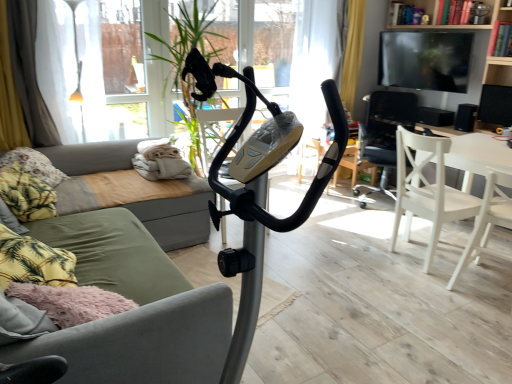
Image resolution: width=512 pixels, height=384 pixels. I want to click on vacant space that is to the left of white wood chair at lower right, placed as the second chair when sorted from front to back, so click(x=360, y=251).